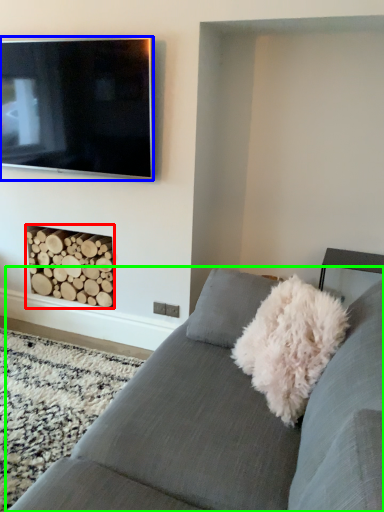
Question: Which is nearer to the fireplace (highlighted by a red box)? television (highlighted by a blue box) or studio couch (highlighted by a green box).

Choices:
 (A) television
 (B) studio couch

Answer: (A)